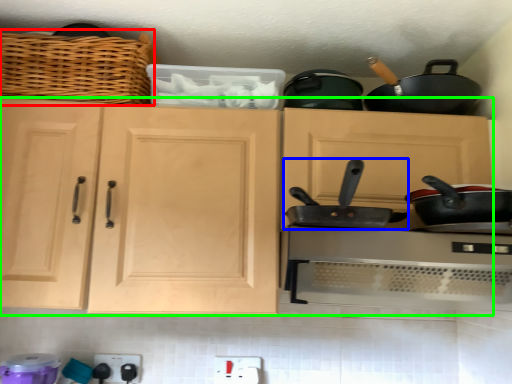
Question: Which is nearer to the basket (highlighted by a red box)? frying pan (highlighted by a blue box) or cabinetry (highlighted by a green box).

Choices:
 (A) frying pan
 (B) cabinetry

Answer: (B)